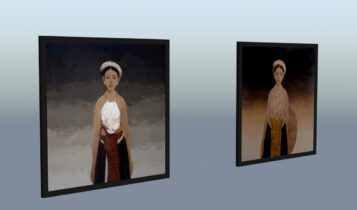
Locate an element on the screen. The image size is (357, 210). painting is located at coordinates (247, 134).